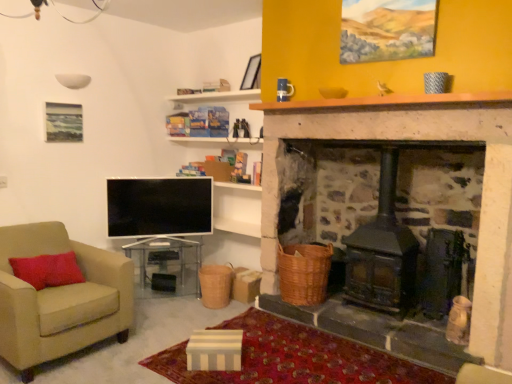
Image resolution: width=512 pixels, height=384 pixels. What are the coordinates of `vacant space in front of clear glass table at center` in the screenshot? It's located at (166, 316).